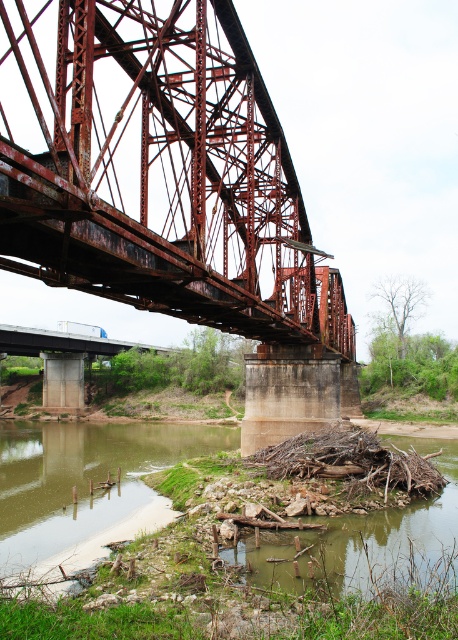
Question: Is rusty metal bridge at center thinner than brown muddy river at lower center?

Choices:
 (A) yes
 (B) no

Answer: (B)

Question: Which of the following is the farthest from the observer?

Choices:
 (A) (414, 547)
 (B) (10, 541)
 (C) (205, 118)

Answer: (B)

Question: Is the position of rusty metal bridge at center more distant than that of green mossy riverbank at lower left?

Choices:
 (A) no
 (B) yes

Answer: (A)

Question: Which point appears farthest from the camera in this image?

Choices:
 (A) (130, 209)
 (B) (267, 540)

Answer: (A)

Question: Considering the real-world distances, which object is closest to the green mossy riverbank at lower left?

Choices:
 (A) brown muddy river at lower center
 (B) rusty metal bridge at center

Answer: (A)

Question: In this image, where is rusty metal bridge at center located relative to brown muddy river at lower center?

Choices:
 (A) above
 (B) below

Answer: (A)